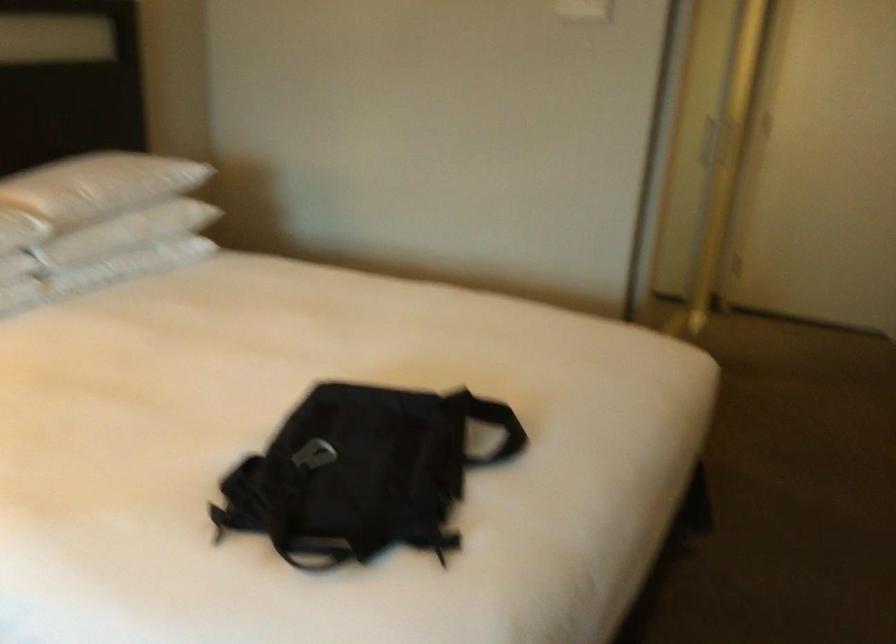
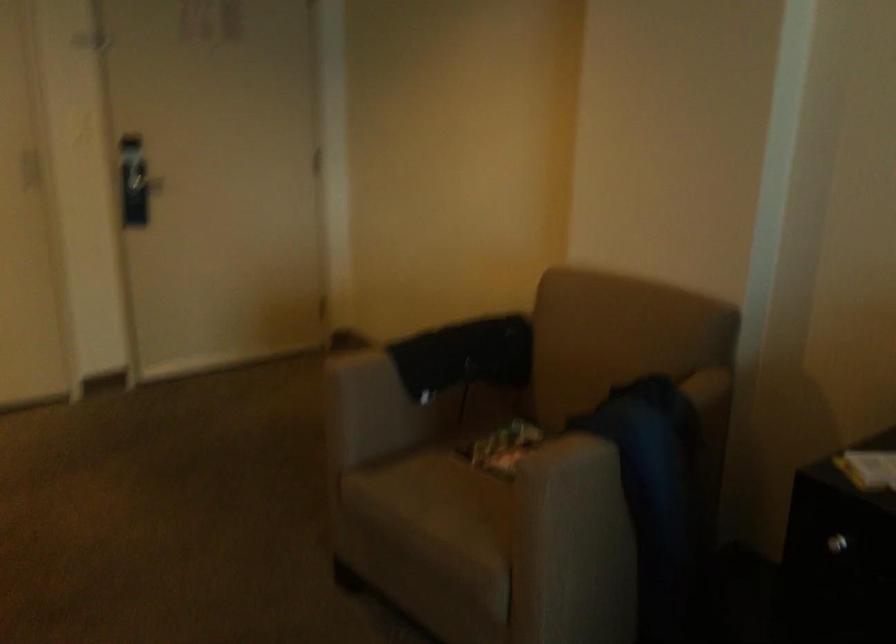
Question: The camera is either moving clockwise (left) or counter-clockwise (right) around the object. The first image is from the beginning of the video and the second image is from the end. Is the camera moving left or right when shooting the video?

Choices:
 (A) Left
 (B) Right

Answer: (A)